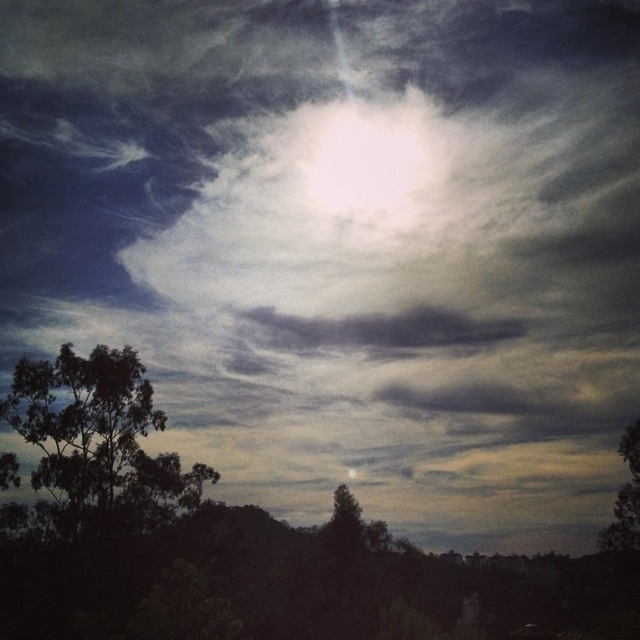
Does dark gray cloud at center come behind green leafy tree at lower right?

Yes.

Does dark gray cloud at center have a smaller size compared to green leafy tree at lower right?

Yes.

Who is more distant from viewer, (323,332) or (636,476)?

Point (323,332)

Identify the location of dark gray cloud at center. (381, 330).

Is dark green leafy tree at left shorter than green leafy tree at lower right?

In fact, dark green leafy tree at left may be taller than green leafy tree at lower right.

Can you confirm if dark green leafy tree at left is positioned to the right of green leafy tree at lower right?

No, dark green leafy tree at left is not to the right of green leafy tree at lower right.

The image size is (640, 640). I want to click on dark green leafy tree at left, so click(x=97, y=442).

Does dark green leafy tree at left appear on the right side of dark gray cloud at center?

No, dark green leafy tree at left is not to the right of dark gray cloud at center.

What are the coordinates of `dark green leafy tree at left` in the screenshot? It's located at (97, 442).